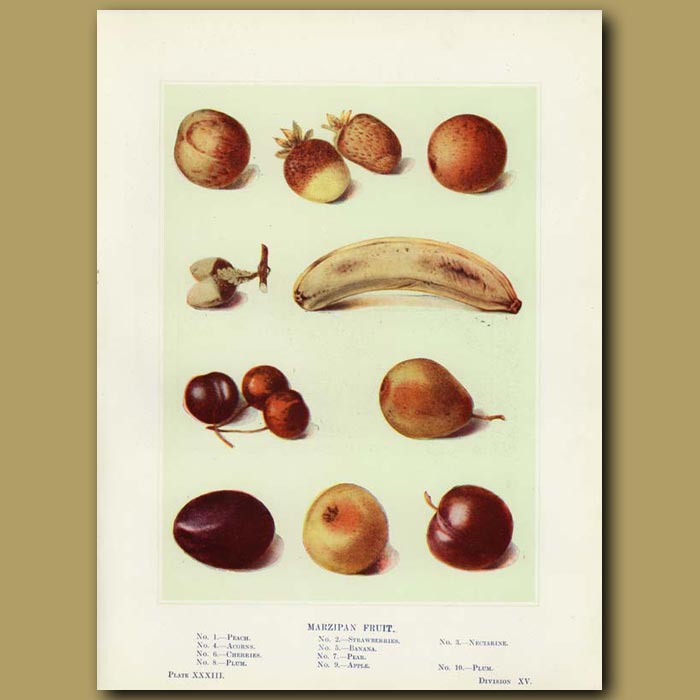
You are a GUI agent. You are given a task and a screenshot of the screen. Output one action in this format:
    pyautogui.click(x=<x>, y=<y>)
    Task: Click on the wall
    This screenshot has width=700, height=700.
    Given the screenshot: What is the action you would take?
    pyautogui.click(x=60, y=250), pyautogui.click(x=645, y=670)